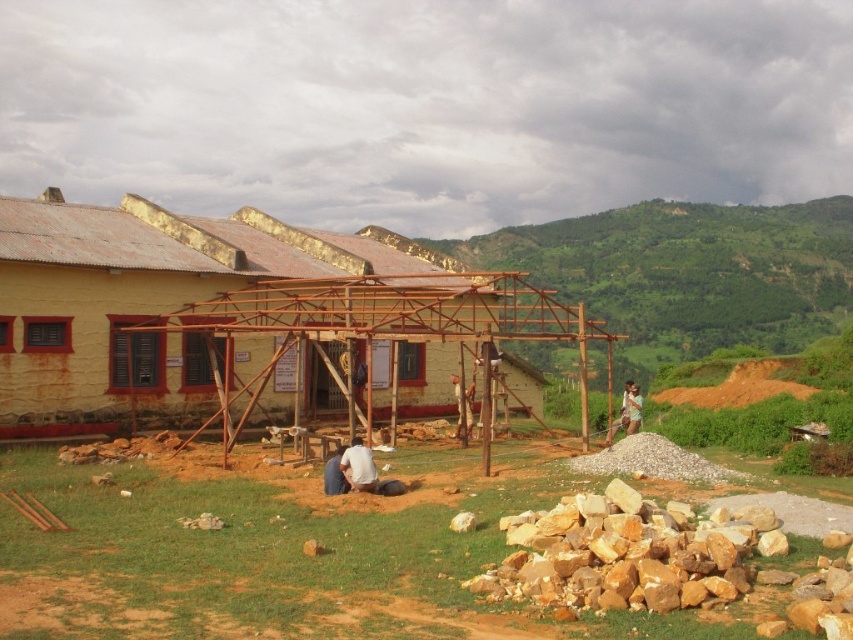
From the picture: You are a safety inspector at the construction site. You notice the yellow painted wood at center and the green fabric shirt at center. Which object is taller? Please answer based on the height comparison between these two objects.

The yellow painted wood at center is much taller than the green fabric shirt at center according to the description.

In the scene shown: You are standing at the point labeled as point [142,301] in the image. What material are you standing on?

You are standing on yellow painted wood at center.

You are a construction worker standing at the edge of the site. You see the yellow painted wood at center and the green fabric shirt at center. Which object is positioned to the left when viewed from your perspective?

The yellow painted wood at center is to the left of the green fabric shirt at center.